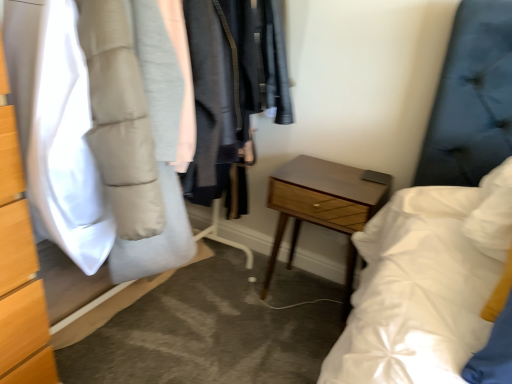
Find the location of `free space in front of woodenmaterial/texturenightstand at center`. free space in front of woodenmaterial/texturenightstand at center is located at coordinates (291, 338).